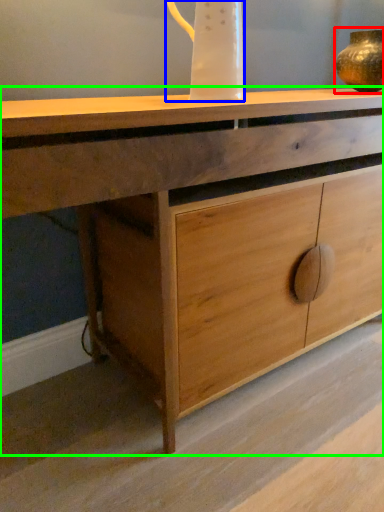
Question: Which is farther away from candle holder (highlighted by a red box)? jug (highlighted by a blue box) or chest of drawers (highlighted by a green box)?

Choices:
 (A) jug
 (B) chest of drawers

Answer: (B)